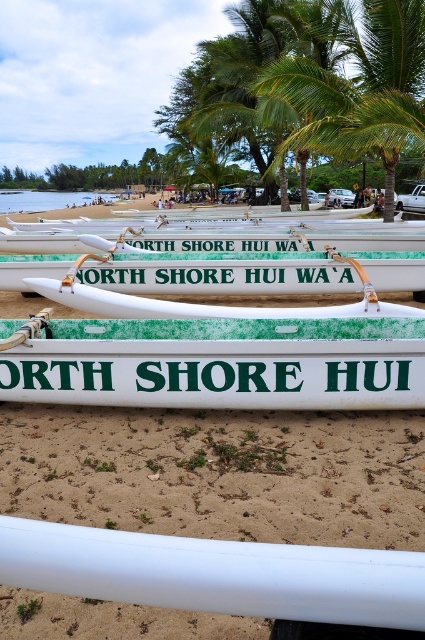
You are a photographer trying to capture both the white plastic canoe at center and the white matte surfboard at center in a single frame. Since you want to ensure both are fully visible, which object should you focus on first to avoid cropping either?

The white plastic canoe at center is taller than the white matte surfboard at center, so you should focus on the white plastic canoe at center first to ensure its full height is captured without cropping.

You are a photographer planning to take a picture of the green leafy palm tree at center and the white glossy canoe at center. Based on their widths, which object should you focus on if you want to capture the wider subject in your photo?

The white glossy canoe at center is wider than the green leafy palm tree at center, so you should focus on the white glossy canoe at center to capture the wider subject in your photo.

You are a photographer standing on the beach and want to capture both the white plastic canoe at center and the white glossy canoe at center in your shot. Based on their positions, which canoe appears closer to you?

The white plastic canoe at center appears closer because it is located above the white glossy canoe at center in the image, indicating it is positioned nearer to the viewer.